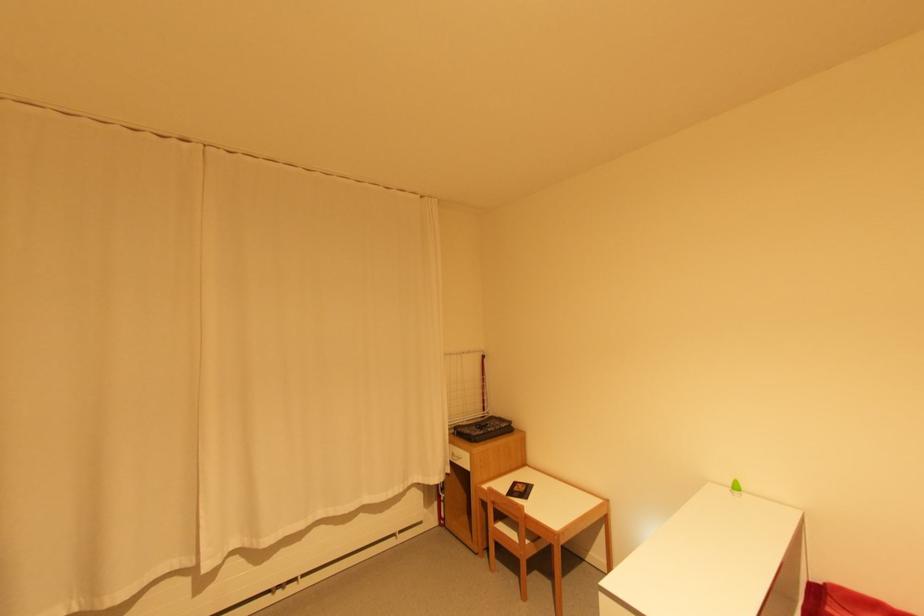
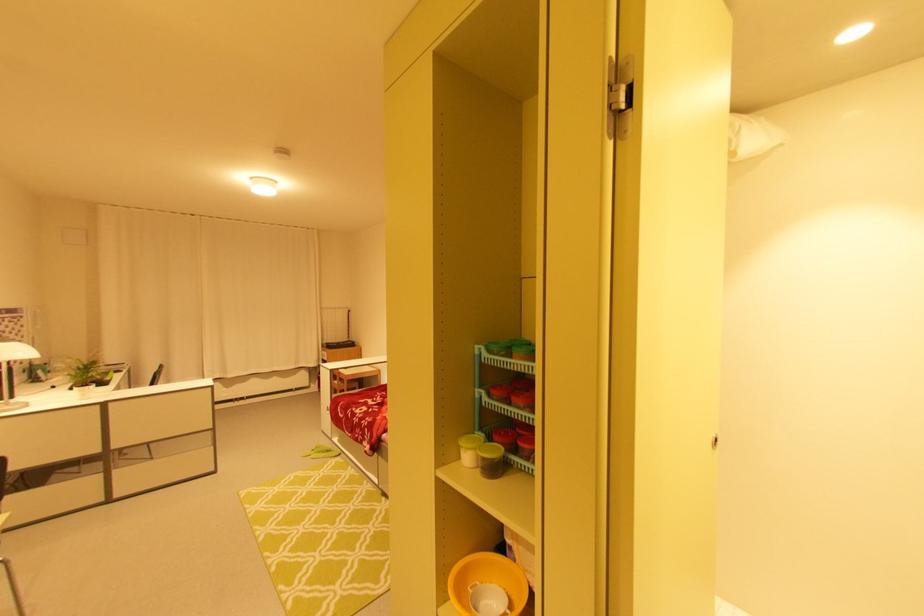
The images are taken continuously from a first-person perspective. In which direction are you moving?

The cameraman moved toward right, backward.